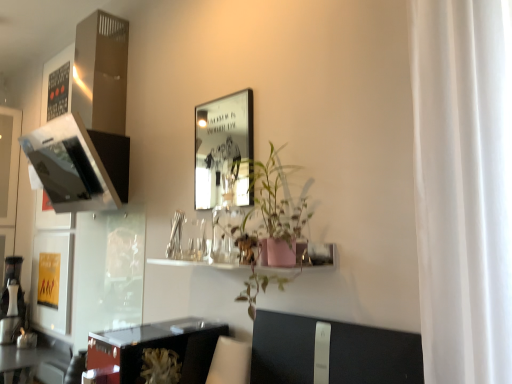
Question: From a real-world perspective, does white plastic swivel chair at lower center sit lower than pink matte plant at center?

Choices:
 (A) yes
 (B) no

Answer: (A)

Question: Can you confirm if white plastic swivel chair at lower center is positioned to the right of pink matte plant at center?

Choices:
 (A) no
 (B) yes

Answer: (A)

Question: Is the position of white plastic swivel chair at lower center less distant than that of pink matte plant at center?

Choices:
 (A) yes
 (B) no

Answer: (B)

Question: Would you say pink matte plant at center is part of white plastic swivel chair at lower center's contents?

Choices:
 (A) no
 (B) yes

Answer: (A)

Question: Could you tell me if white plastic swivel chair at lower center is turned towards pink matte plant at center?

Choices:
 (A) no
 (B) yes

Answer: (A)

Question: Are white plastic swivel chair at lower center and pink matte plant at center making contact?

Choices:
 (A) yes
 (B) no

Answer: (B)

Question: Is shiny black table at lower left, placed as the second table when sorted from left to right, with shiny black table at lower left, the 1th table viewed from the left?

Choices:
 (A) yes
 (B) no

Answer: (B)

Question: Does shiny black table at lower left, which appears as the 1th table when viewed from the right, have a greater height compared to shiny black table at lower left, which is the 2th table in front-to-back order?

Choices:
 (A) yes
 (B) no

Answer: (A)

Question: Is shiny black table at lower left, placed as the 2th table when sorted from back to front, positioned behind shiny black table at lower left, placed as the 1th table when sorted from back to front?

Choices:
 (A) yes
 (B) no

Answer: (B)

Question: Can we say shiny black table at lower left, placed as the 2th table when sorted from back to front, lies outside shiny black table at lower left, the 2th table in the top-to-bottom sequence?

Choices:
 (A) yes
 (B) no

Answer: (A)

Question: Is shiny black table at lower left, acting as the 2th table starting from the right, at the back of shiny black table at lower left, placed as the 2th table when sorted from back to front?

Choices:
 (A) yes
 (B) no

Answer: (B)

Question: Can you confirm if shiny black table at lower left, the second table from the bottom, is smaller than shiny black table at lower left, which is the first table in bottom-to-top order?

Choices:
 (A) no
 (B) yes

Answer: (A)

Question: Is shiny black table at lower left, which appears as the 1th table when viewed from the right, positioned before pink matte shelf at center?

Choices:
 (A) yes
 (B) no

Answer: (A)